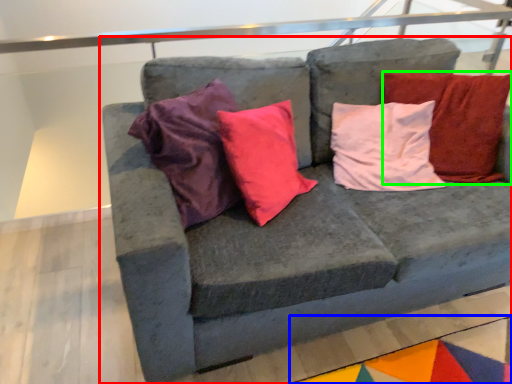
Question: Which object is positioned farthest from studio couch (highlighted by a red box)? Select from mat (highlighted by a blue box) and pillow (highlighted by a green box).

Choices:
 (A) mat
 (B) pillow

Answer: (A)